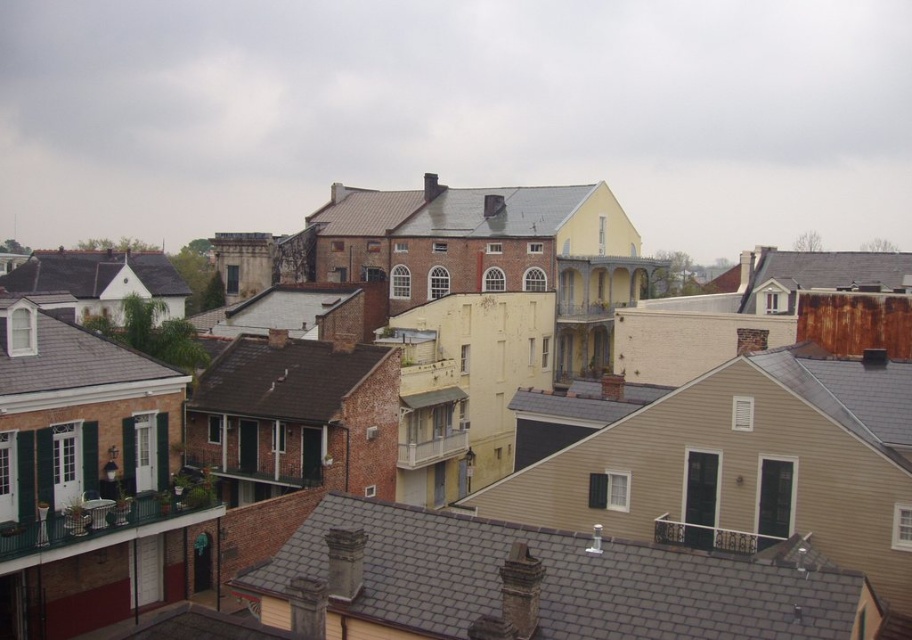
Is brown brick roof at center taller than white shingles at lower left?

Yes.

Is point (261, 340) positioned after point (98, 353)?

That is True.

Who is more forward, (281, 387) or (9, 348)?

Point (9, 348) is more forward.

You are a GUI agent. You are given a task and a screenshot of the screen. Output one action in this format:
    pyautogui.click(x=<x>, y=<y>)
    Task: Click on the brown brick roof at center
    The width and height of the screenshot is (912, 640).
    Given the screenshot: What is the action you would take?
    pyautogui.click(x=283, y=378)

Can you confirm if brown brick roof at center is smaller than shiny black roof at left?

Correct, brown brick roof at center occupies less space than shiny black roof at left.

Which of these two, brown brick roof at center or shiny black roof at left, stands taller?

Standing taller between the two is shiny black roof at left.

Does point (282, 385) come closer to viewer compared to point (63, 273)?

Yes.

You are a GUI agent. You are given a task and a screenshot of the screen. Output one action in this format:
    pyautogui.click(x=<x>, y=<y>)
    Task: Click on the brown brick roof at center
    The height and width of the screenshot is (640, 912).
    Given the screenshot: What is the action you would take?
    pyautogui.click(x=283, y=378)

Who is positioned more to the right, gray slate roof at center or white shingles at lower left?

gray slate roof at center is more to the right.

Between gray slate roof at center and white shingles at lower left, which one appears on the left side from the viewer's perspective?

Positioned to the left is white shingles at lower left.

Is point (368, 513) farther from viewer compared to point (16, 378)?

No, it is in front of (16, 378).

Find the location of a particular element. The height and width of the screenshot is (640, 912). gray slate roof at center is located at coordinates (536, 582).